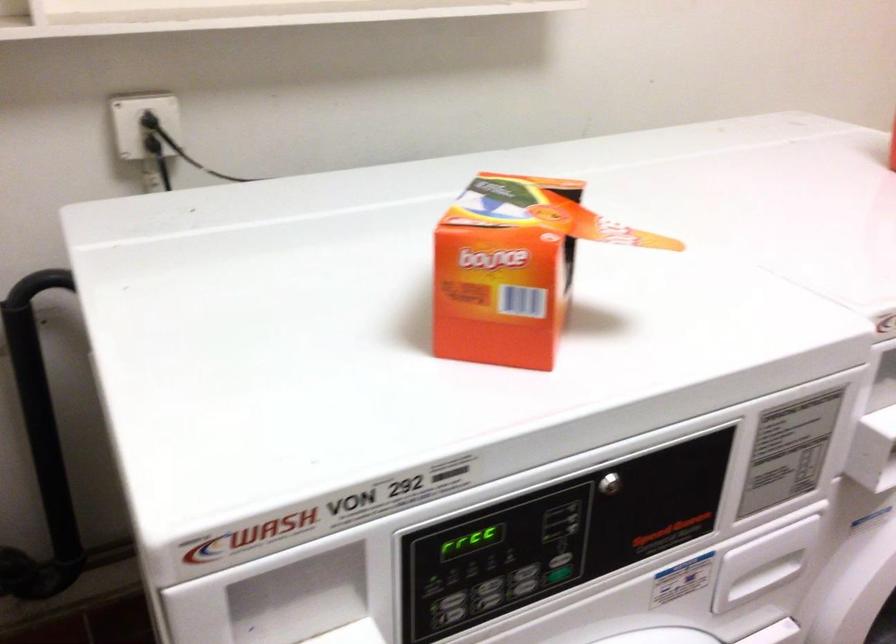
Describe the element at coordinates (524, 587) in the screenshot. I see `the dark control button` at that location.